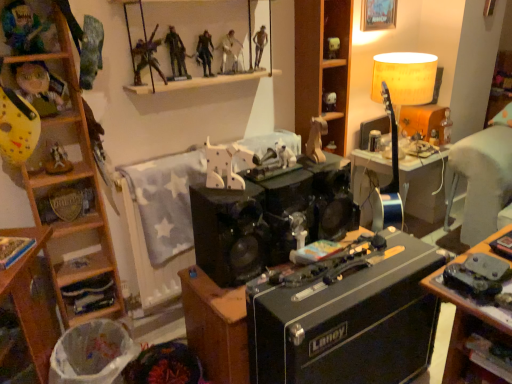
Question: From a real-world perspective, is matte yellow lampshade at upper right physically located above or below smooth white figure at upper center, which is the 2th person from right to left?

Choices:
 (A) below
 (B) above

Answer: (A)

Question: Is matte yellow lampshade at upper right to the left or to the right of smooth white figure at upper center, which is the 2th person from right to left, in the image?

Choices:
 (A) left
 (B) right

Answer: (B)

Question: Considering the real-world distances, which object is farthest from the matte plastic action figure at upper center, which is counted as the fifth toy, starting from the bottom?

Choices:
 (A) metallic figure at upper center, which is the 3th person from left to right
 (B) wooden horse at center, which appears as the fourth toy when viewed from the right
 (C) matte yellow lampshade at upper right
 (D) matte yellow mask at left, placed as the seventh person when sorted from right to left
 (E) smooth white figure at upper center, which is the 6th person in left-to-right order

Answer: (D)

Question: Which object is positioned farthest from the smooth white figure at upper center, which is the 6th person in left-to-right order?

Choices:
 (A) matte yellow mask at left, positioned as the first person in left-to-right order
 (B) matte yellow lampshade at upper right
 (C) wooden cabinet at left
 (D) wooden horse at center, the 5th toy from the back
 (E) metallic figure at upper center, which is the fourth person from left to right

Answer: (C)